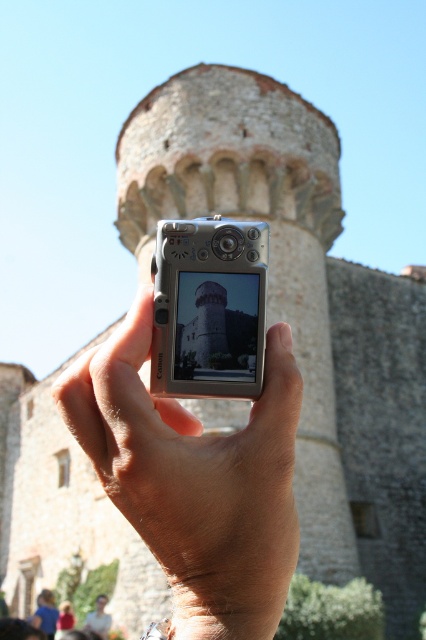
Based on the photo, you are a photographer trying to frame a shot of the historic stone tower. You notice the smooth skin hand at center and the silver metallic camera at center in your viewfinder. Which object is closer to the camera lens?

The smooth skin hand at center is closer to the camera lens because it is in front of the silver metallic camera at center.

Consider the image. Based on the scene description, where is the smooth skin hand at center located in terms of its 2D coordinates?

The smooth skin hand at center is located at the 2D coordinates of point (195,480).

You are a photographer trying to capture a historic stone tower. You notice your hand and camera in the frame. Which object, the smooth skin hand at center or the silver metallic camera at center, takes up more space in the image?

The smooth skin hand at center takes up more space in the image as it is bigger than the silver metallic camera at center.